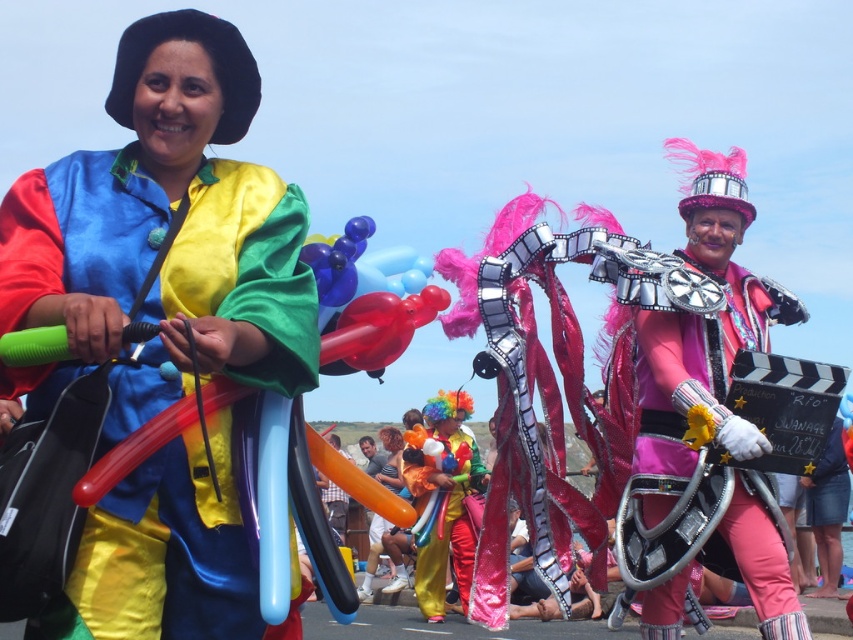
Can you confirm if pink satin film strip at center is thinner than shiny metallic clown at center?

No.

The height and width of the screenshot is (640, 853). What do you see at coordinates (699, 461) in the screenshot?
I see `pink satin film strip at center` at bounding box center [699, 461].

Find the location of a particular element. Image resolution: width=853 pixels, height=640 pixels. pink satin film strip at center is located at coordinates (699, 461).

Does pink satin film strip at center come behind translucent red balloon at center?

That is True.

Who is more distant from viewer, (764, 630) or (405, 333)?

Positioned behind is point (764, 630).

The height and width of the screenshot is (640, 853). I want to click on pink satin film strip at center, so click(699, 461).

Can you confirm if translucent red balloon at center is wider than shiny metallic clown at center?

No, translucent red balloon at center is not wider than shiny metallic clown at center.

Is translucent red balloon at center positioned before shiny metallic clown at center?

Yes, translucent red balloon at center is in front of shiny metallic clown at center.

I want to click on translucent red balloon at center, so click(x=368, y=300).